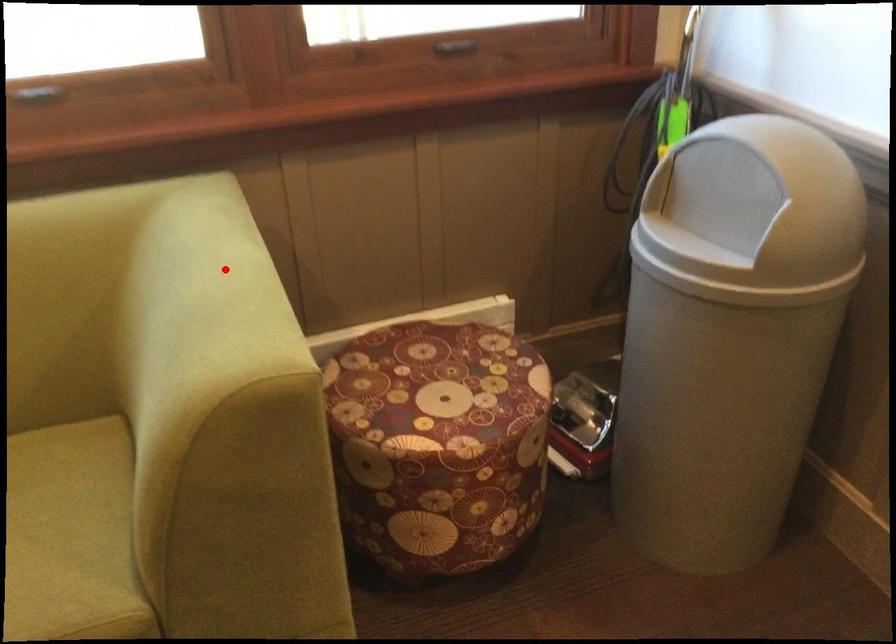
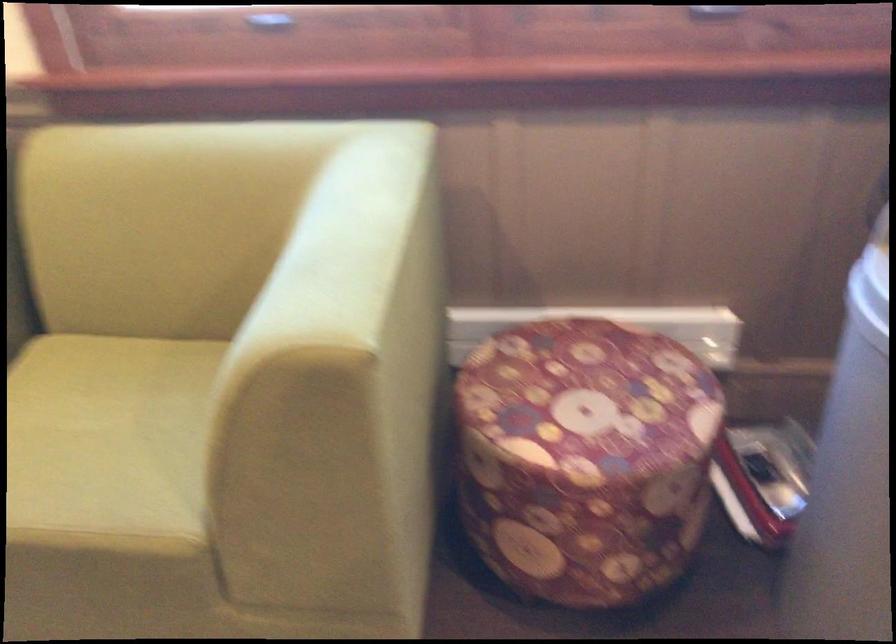
Locate, in the second image, the point that corresponds to the highlighted location in the first image.

(358, 223)